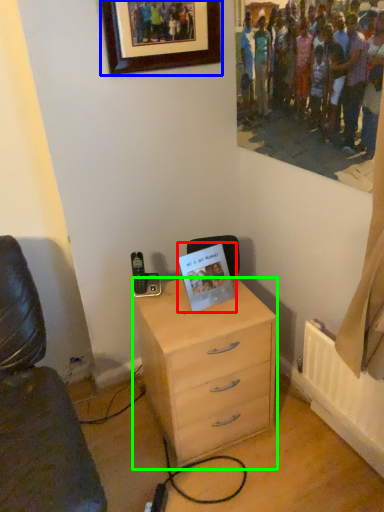
Question: Which is farther away from postcard (highlighted by a red box)? picture frame (highlighted by a blue box) or chest of drawers (highlighted by a green box)?

Choices:
 (A) picture frame
 (B) chest of drawers

Answer: (A)